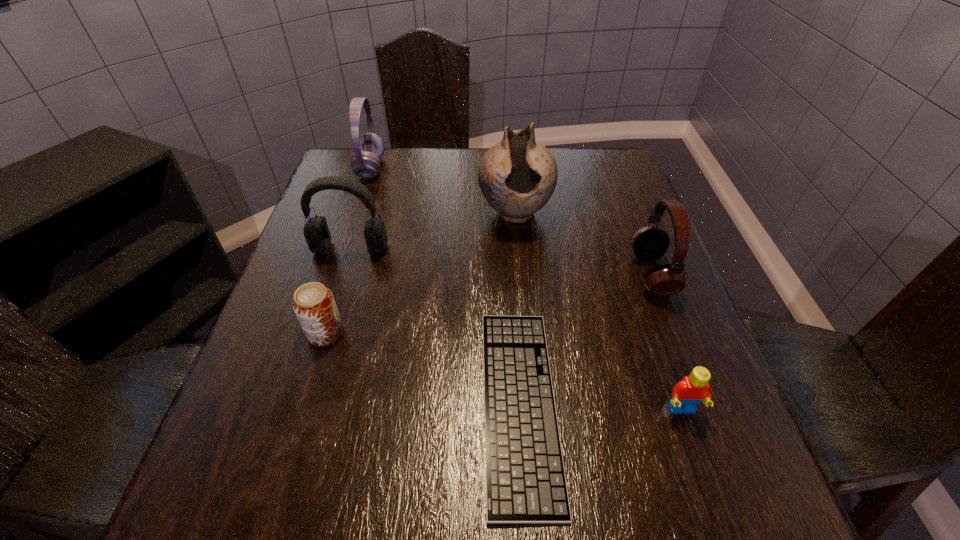
What are the coordinates of `pottery` in the screenshot? It's located at (517, 176).

Identify the location of the farthest headset. The width and height of the screenshot is (960, 540). (369, 148).

Identify the location of the rightmost headset. (649, 243).

This screenshot has height=540, width=960. What are the coordinates of `beer can` in the screenshot? It's located at (314, 305).

At what (x,y) coordinates should I click in order to perform the action: click on Lego. Please return your answer as a coordinate pair (x, y). The image size is (960, 540). Looking at the image, I should click on (691, 390).

At what (x,y) coordinates should I click in order to perform the action: click on the shortest object. Please return your answer as a coordinate pair (x, y). This screenshot has width=960, height=540. Looking at the image, I should click on (525, 478).

Where is `free space located from the spout of the tallest object`? free space located from the spout of the tallest object is located at coordinates (522, 296).

Where is `vacant space located 0.120m on the headband and ear cups of the farthest object`? The image size is (960, 540). vacant space located 0.120m on the headband and ear cups of the farthest object is located at coordinates (426, 168).

In order to click on blank space located 0.400m on the ear pads of the rightmost headset in this screenshot , I will do `click(453, 274)`.

I want to click on free region located on the ear pads of the rightmost headset, so click(x=580, y=274).